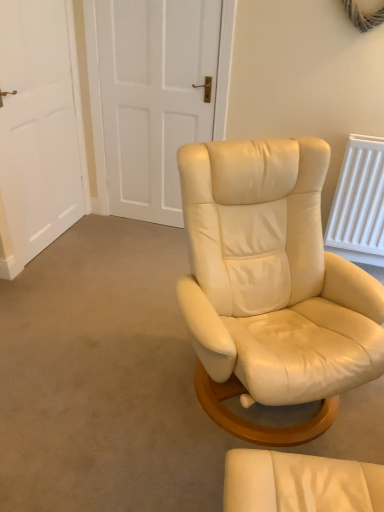
The width and height of the screenshot is (384, 512). I want to click on free area in between white matte door at upper left, which is counted as the 1th door, starting from the left, and matte cream leather chair at center, so click(x=123, y=336).